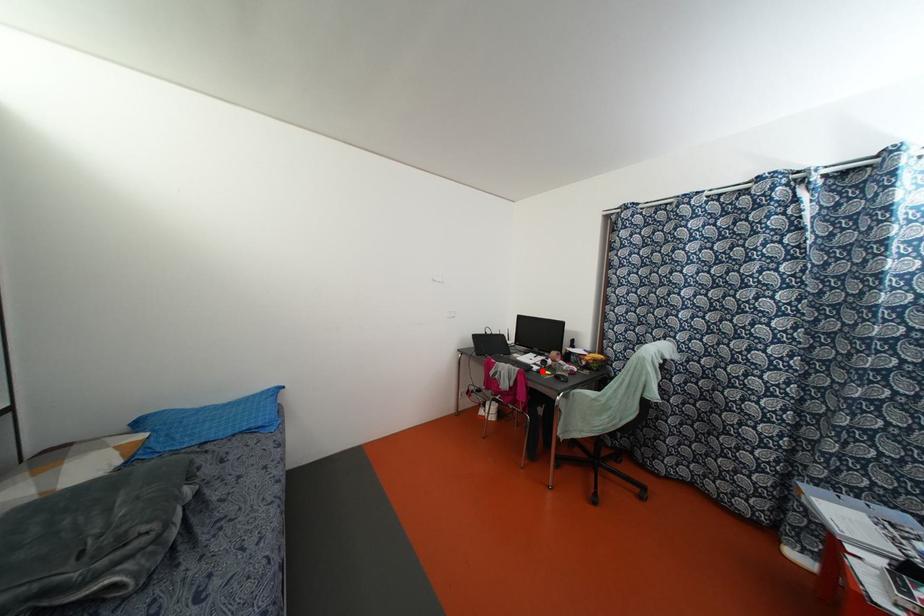
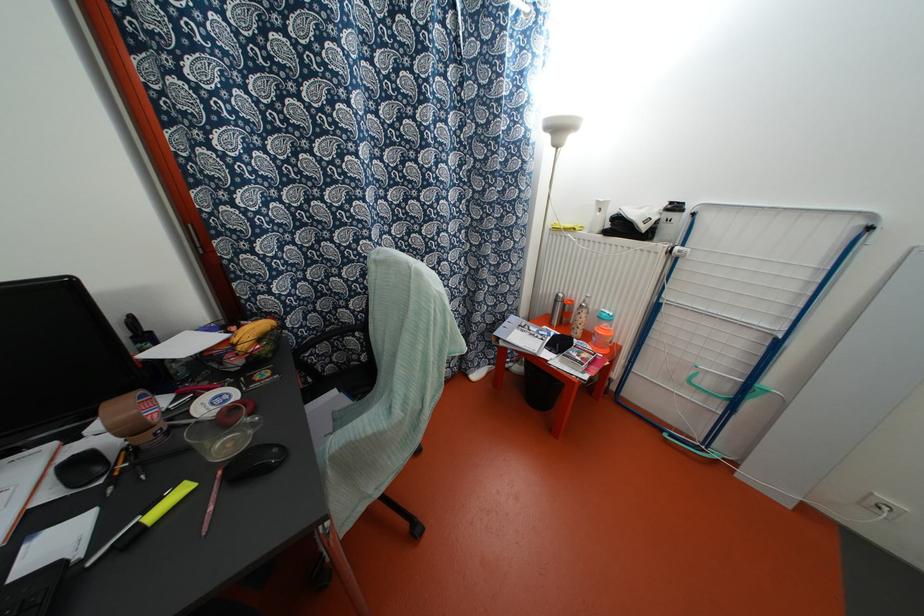
The point at the highlighted location is marked in the first image. Where is the corresponding point in the second image?

(152, 515)